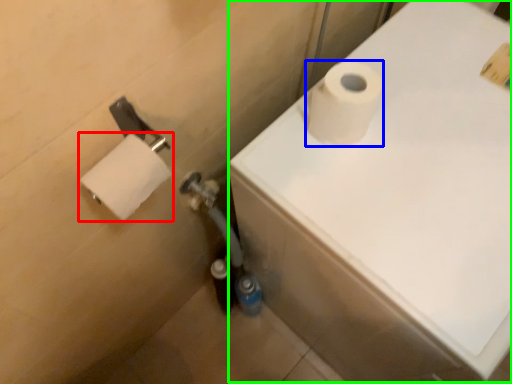
Question: Which object is positioned farthest from toilet paper (highlighted by a red box)? Select from toilet paper (highlighted by a blue box) and bath (highlighted by a green box).

Choices:
 (A) toilet paper
 (B) bath

Answer: (B)